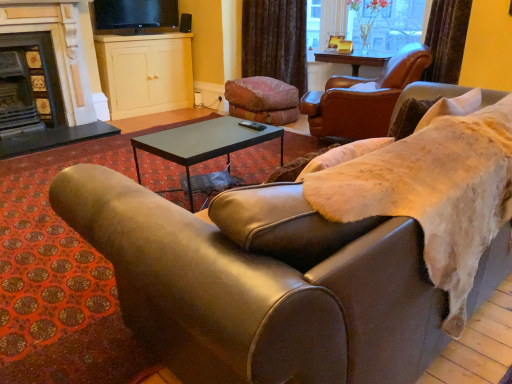
Describe the element at coordinates (275, 41) in the screenshot. This screenshot has width=512, height=384. I see `velvet brown curtain at upper center` at that location.

The image size is (512, 384). Find the location of `clear glass vase at upper center`. clear glass vase at upper center is located at coordinates (387, 25).

What is the approximate height of black metal coffee table at center?

20.18 inches.

Measure the distance between point (x=202, y=331) and camera.

A distance of 31.93 inches exists between point (x=202, y=331) and camera.

Measure the distance between point (136, 19) and camera.

A distance of 15.54 feet exists between point (136, 19) and camera.

Where is `velvet brown curtain at upper center`? This screenshot has height=384, width=512. velvet brown curtain at upper center is located at coordinates (275, 41).

Considering the sizes of objects velvet brown curtain at upper center and clear glass vase at upper center in the image provided, who is shorter, velvet brown curtain at upper center or clear glass vase at upper center?

Standing shorter between the two is clear glass vase at upper center.

Are velvet brown curtain at upper center and clear glass vase at upper center making contact?

They are not placed beside each other.

Considering the positions of objects velvet brown curtain at upper center and clear glass vase at upper center in the image provided, who is behind, velvet brown curtain at upper center or clear glass vase at upper center?

velvet brown curtain at upper center is behind.

Looking at this image, from a real-world perspective, does velvet brown curtain at upper center stand above clear glass vase at upper center?

Actually, velvet brown curtain at upper center is physically below clear glass vase at upper center in the real world.

Is black glossy tv at upper center surrounded by clear glass vase at upper center?

That's incorrect, black glossy tv at upper center is not inside clear glass vase at upper center.

Which of these two, clear glass vase at upper center or black glossy tv at upper center, is smaller?

With smaller size is black glossy tv at upper center.

Considering the relative positions of clear glass vase at upper center and black glossy tv at upper center in the image provided, is clear glass vase at upper center to the left of black glossy tv at upper center from the viewer's perspective?

No, clear glass vase at upper center is not to the left of black glossy tv at upper center.

Is matte tiled fireplace at left, positioned as the first fireplace in left-to-right order, taller or shorter than black glossy tv at upper center?

Clearly, matte tiled fireplace at left, positioned as the first fireplace in left-to-right order, is taller compared to black glossy tv at upper center.

Considering the sizes of objects matte tiled fireplace at left, which is counted as the second fireplace, starting from the right, and black glossy tv at upper center in the image provided, who is wider, matte tiled fireplace at left, which is counted as the second fireplace, starting from the right, or black glossy tv at upper center?

matte tiled fireplace at left, which is counted as the second fireplace, starting from the right.

From the image's perspective, which is above, matte tiled fireplace at left, positioned as the first fireplace in left-to-right order, or black glossy tv at upper center?

black glossy tv at upper center appears higher in the image.

Considering the relative positions of matte tiled fireplace at left, positioned as the first fireplace in left-to-right order, and black glossy tv at upper center in the image provided, is matte tiled fireplace at left, positioned as the first fireplace in left-to-right order, to the left or to the right of black glossy tv at upper center?

Based on their positions, matte tiled fireplace at left, positioned as the first fireplace in left-to-right order, is located to the left of black glossy tv at upper center.

From a real-world perspective, between leather armchair at upper right and matte cream cabinet at upper center, who is vertically higher?

leather armchair at upper right.

How distant is leather armchair at upper right from matte cream cabinet at upper center?

A distance of 7.37 feet exists between leather armchair at upper right and matte cream cabinet at upper center.

Considering the relative positions of leather armchair at upper right and matte cream cabinet at upper center in the image provided, is leather armchair at upper right to the left of matte cream cabinet at upper center from the viewer's perspective?

No.

Considering the sizes of leather armchair at upper right and matte cream cabinet at upper center in the image, is leather armchair at upper right taller or shorter than matte cream cabinet at upper center?

In the image, leather armchair at upper right appears to be shorter than matte cream cabinet at upper center.

I want to click on the 2nd fireplace counting from the left side of the matte cream cabinet at upper center, so click(x=29, y=84).

Is matte tiled fireplace at left, positioned as the first fireplace in left-to-right order, in front of or behind matte cream cabinet at upper center in the image?

Clearly, matte tiled fireplace at left, positioned as the first fireplace in left-to-right order, is in front of matte cream cabinet at upper center.

In the scene shown: Which is closer to the camera, (6, 125) or (110, 37)?

The point (6, 125) is in front.

Is matte tiled fireplace at left, positioned as the first fireplace in left-to-right order, next to matte cream cabinet at upper center and touching it?

matte tiled fireplace at left, positioned as the first fireplace in left-to-right order, and matte cream cabinet at upper center are not in contact.

Is matte cream cabinet at upper center turned away from leather armchair at upper right?

No.

From the image's perspective, which object appears higher, matte cream cabinet at upper center or leather armchair at upper right?

matte cream cabinet at upper center, from the image's perspective.

Would you say matte cream cabinet at upper center is outside leather armchair at upper right?

matte cream cabinet at upper center lies outside leather armchair at upper right's area.

From the picture: Considering the sizes of objects dark gray stone fireplace at left, marked as the second fireplace in a left-to-right arrangement, and black metal coffee table at center in the image provided, who is bigger, dark gray stone fireplace at left, marked as the second fireplace in a left-to-right arrangement, or black metal coffee table at center?

dark gray stone fireplace at left, marked as the second fireplace in a left-to-right arrangement.

Do you think dark gray stone fireplace at left, marked as the second fireplace in a left-to-right arrangement, is within black metal coffee table at center, or outside of it?

dark gray stone fireplace at left, marked as the second fireplace in a left-to-right arrangement, is not inside black metal coffee table at center, it's outside.

How much distance is there between dark gray stone fireplace at left, positioned as the 1th fireplace in right-to-left order, and black metal coffee table at center?

dark gray stone fireplace at left, positioned as the 1th fireplace in right-to-left order, is 2.12 meters away from black metal coffee table at center.

Can you see dark gray stone fireplace at left, marked as the second fireplace in a left-to-right arrangement, touching black metal coffee table at center?

No, dark gray stone fireplace at left, marked as the second fireplace in a left-to-right arrangement, is not making contact with black metal coffee table at center.

Find the location of a particular element. The height and width of the screenshot is (384, 512). curtain on the left of clear glass vase at upper center is located at coordinates (275, 41).

This screenshot has height=384, width=512. Find the location of `television located behind the clear glass vase at upper center`. television located behind the clear glass vase at upper center is located at coordinates (135, 14).

Estimate the real-world distances between objects in this image. Which object is closer to black metal coffee table at center, leather armchair at upper right or leather couch at center?

leather couch at center is positioned closer to the anchor black metal coffee table at center.

From the image, which object appears to be farther from leather armchair at upper right, dark gray stone fireplace at left, marked as the second fireplace in a left-to-right arrangement, or leather couch at center?

The object further to leather armchair at upper right is leather couch at center.

Which object lies nearer to the anchor point matte cream cabinet at upper center, black glossy tv at upper center or dark gray stone fireplace at left, marked as the second fireplace in a left-to-right arrangement?

The object closer to matte cream cabinet at upper center is black glossy tv at upper center.

Estimate the real-world distances between objects in this image. Which object is closer to velvet brown curtain at upper center, black glossy tv at upper center or clear glass vase at upper center?

Among the two, clear glass vase at upper center is located nearer to velvet brown curtain at upper center.

Looking at the image, which one is located closer to leather couch at center, velvet pink swivel chair at center or matte cream cabinet at upper center?

The object closer to leather couch at center is velvet pink swivel chair at center.

Estimate the real-world distances between objects in this image. Which object is further from black metal coffee table at center, leather armchair at upper right or velvet pink swivel chair at center?

velvet pink swivel chair at center lies further to black metal coffee table at center than the other object.

Considering their positions, is velvet pink swivel chair at center positioned closer to matte cream cabinet at upper center than black metal coffee table at center?

Based on the image, velvet pink swivel chair at center appears to be nearer to matte cream cabinet at upper center.

Based on their spatial positions, is leather couch at center or black metal coffee table at center further from matte cream cabinet at upper center?

Among the two, leather couch at center is located further to matte cream cabinet at upper center.

Find the location of `coffee table between dark gray stone fireplace at left, marked as the second fireplace in a left-to-right arrangement, and velvet pink swivel chair at center`. coffee table between dark gray stone fireplace at left, marked as the second fireplace in a left-to-right arrangement, and velvet pink swivel chair at center is located at coordinates (203, 143).

You are a GUI agent. You are given a task and a screenshot of the screen. Output one action in this format:
    pyautogui.click(x=<x>, y=<y>)
    Task: Click on the television located between matte tiled fireplace at left, positioned as the first fireplace in left-to-right order, and clear glass vase at upper center in the left-right direction
    This screenshot has width=512, height=384.
    Given the screenshot: What is the action you would take?
    pyautogui.click(x=135, y=14)

Identify the location of swivel chair between dark gray stone fireplace at left, positioned as the 1th fireplace in right-to-left order, and velvet brown curtain at upper center. The width and height of the screenshot is (512, 384). (262, 100).

This screenshot has height=384, width=512. What are the coordinates of `chair between leather couch at center and velvet pink swivel chair at center from front to back` in the screenshot? It's located at (362, 98).